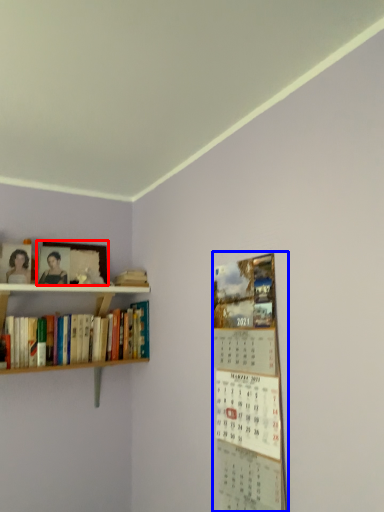
Question: Among these objects, which one is farthest to the camera, picture frame (highlighted by a red box) or bulletin board (highlighted by a blue box)?

Choices:
 (A) picture frame
 (B) bulletin board

Answer: (A)